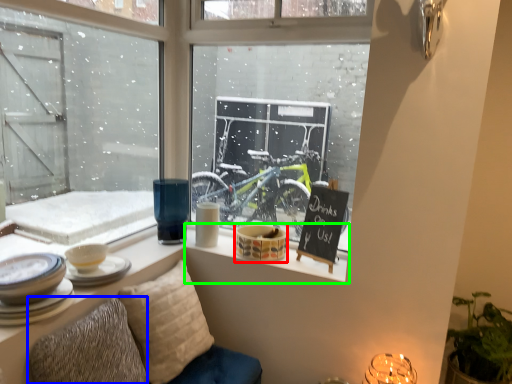
Question: Considering the real-world distances, which object is closest to tableware (highlighted by a red box)? pillow (highlighted by a blue box) or window sill (highlighted by a green box).

Choices:
 (A) pillow
 (B) window sill

Answer: (B)